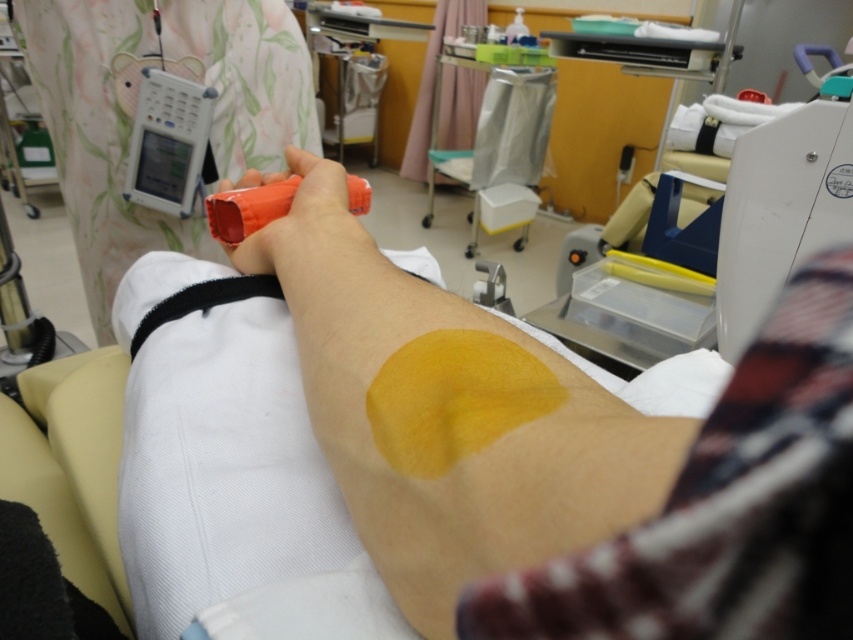
You are a nurse in a hospital room. You need to place the matte plastic device at upper left and the metallic silver trash can at center into their correct storage locations. According to the spatial arrangement shown, which object is closer to the front of the room?

The matte plastic device at upper left is closer to the front of the room because it is in front of the metallic silver trash can at center.